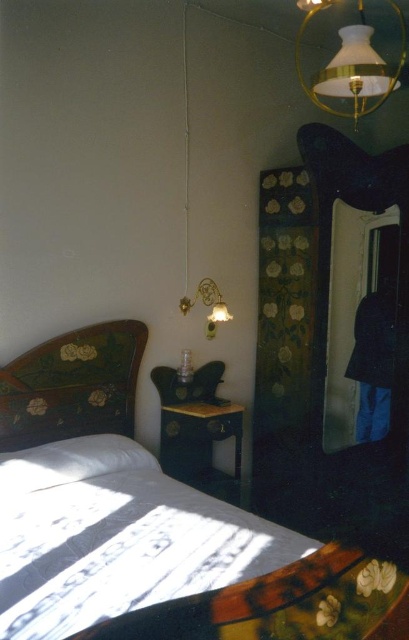
The image size is (409, 640). In order to click on wooden floral-patterned headboard at left in this screenshot , I will do `click(72, 385)`.

Between wooden floral-patterned headboard at left and white soft pillow at lower left, which one is positioned lower?

white soft pillow at lower left is lower down.

Identify the location of wooden floral-patterned headboard at left. (72, 385).

Can you confirm if wooden bed with floral pattern at center is wider than white soft pillow at lower left?

In fact, wooden bed with floral pattern at center might be narrower than white soft pillow at lower left.

Consider the image. Is wooden bed with floral pattern at center smaller than white soft pillow at lower left?

No.

Measure the distance between point (119, 376) and camera.

They are 10.47 feet apart.

The height and width of the screenshot is (640, 409). I want to click on wooden bed with floral pattern at center, so click(x=280, y=605).

Locate an element on the screen. wooden bed with floral pattern at center is located at coordinates coord(280,605).

Between wooden bed with floral pattern at center and wooden floral-patterned headboard at left, which one is positioned lower?

wooden floral-patterned headboard at left

This screenshot has width=409, height=640. I want to click on wooden bed with floral pattern at center, so click(280, 605).